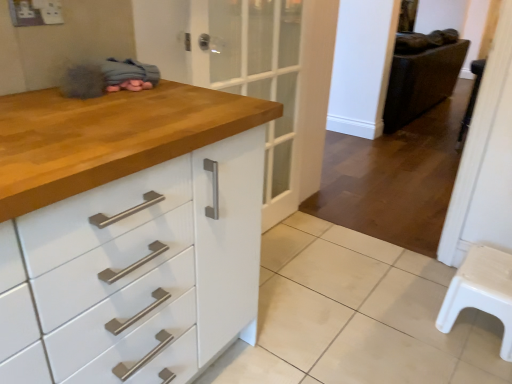
Question: Is leather-like dark brown chair at right at the left side of white plastic step stool at right?

Choices:
 (A) yes
 (B) no

Answer: (A)

Question: Are leather-like dark brown chair at right and white plastic step stool at right located far from each other?

Choices:
 (A) yes
 (B) no

Answer: (A)

Question: Is the depth of leather-like dark brown chair at right less than that of white plastic step stool at right?

Choices:
 (A) yes
 (B) no

Answer: (B)

Question: Is leather-like dark brown chair at right touching white plastic step stool at right?

Choices:
 (A) yes
 (B) no

Answer: (B)

Question: Can you confirm if leather-like dark brown chair at right is taller than white plastic step stool at right?

Choices:
 (A) yes
 (B) no

Answer: (A)

Question: Does leather-like dark brown chair at right appear on the right side of white plastic step stool at right?

Choices:
 (A) yes
 (B) no

Answer: (B)

Question: From the image's perspective, is white glossy tile at lower center over leather-like dark brown chair at right?

Choices:
 (A) yes
 (B) no

Answer: (B)

Question: Is the position of white glossy tile at lower center less distant than that of leather-like dark brown chair at right?

Choices:
 (A) no
 (B) yes

Answer: (B)

Question: Is leather-like dark brown chair at right a part of white glossy tile at lower center?

Choices:
 (A) yes
 (B) no

Answer: (B)

Question: Is white glossy tile at lower center at the right side of leather-like dark brown chair at right?

Choices:
 (A) yes
 (B) no

Answer: (B)

Question: Considering the relative positions of white glossy tile at lower center and leather-like dark brown chair at right in the image provided, is white glossy tile at lower center to the left of leather-like dark brown chair at right from the viewer's perspective?

Choices:
 (A) no
 (B) yes

Answer: (B)

Question: Is white glossy tile at lower center shorter than leather-like dark brown chair at right?

Choices:
 (A) yes
 (B) no

Answer: (A)

Question: From the image's perspective, is white plastic stool at lower right on top of leather-like dark brown chair at right?

Choices:
 (A) yes
 (B) no

Answer: (B)